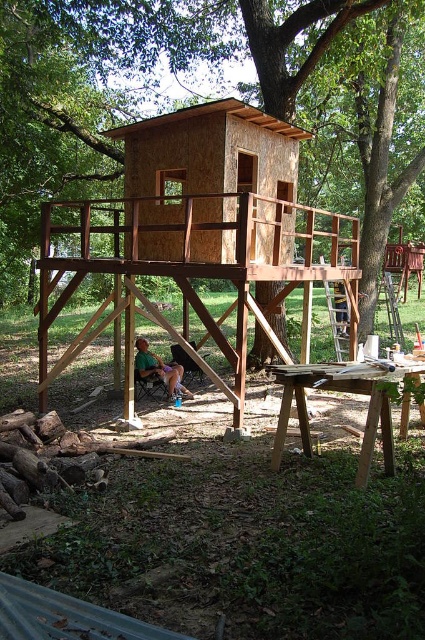
Describe the element at coordinates (198, 234) in the screenshot. I see `wooden cabin at center` at that location.

Between wooden cabin at center and green fabric shirt at lower center, which one appears on the right side from the viewer's perspective?

wooden cabin at center is more to the right.

Measure the distance between wooden cabin at center and camera.

8.41 meters

Where is `wooden cabin at center`? This screenshot has width=425, height=640. wooden cabin at center is located at coordinates (198, 234).

Which is more to the left, wooden treehouse at center or green fabric shirt at lower center?

green fabric shirt at lower center is more to the left.

Who is more distant from viewer, [385,131] or [155,371]?

The point [385,131] is more distant.

This screenshot has width=425, height=640. What are the coordinates of `wooden treehouse at center` in the screenshot? It's located at (238, 88).

Between wooden treehouse at center and wooden cabin at center, which one is positioned higher?

wooden treehouse at center is higher up.

From the picture: Who is more forward, (31, 8) or (235, 129)?

Point (235, 129) is in front.

Where is `wooden treehouse at center`? The image size is (425, 640). wooden treehouse at center is located at coordinates (238, 88).